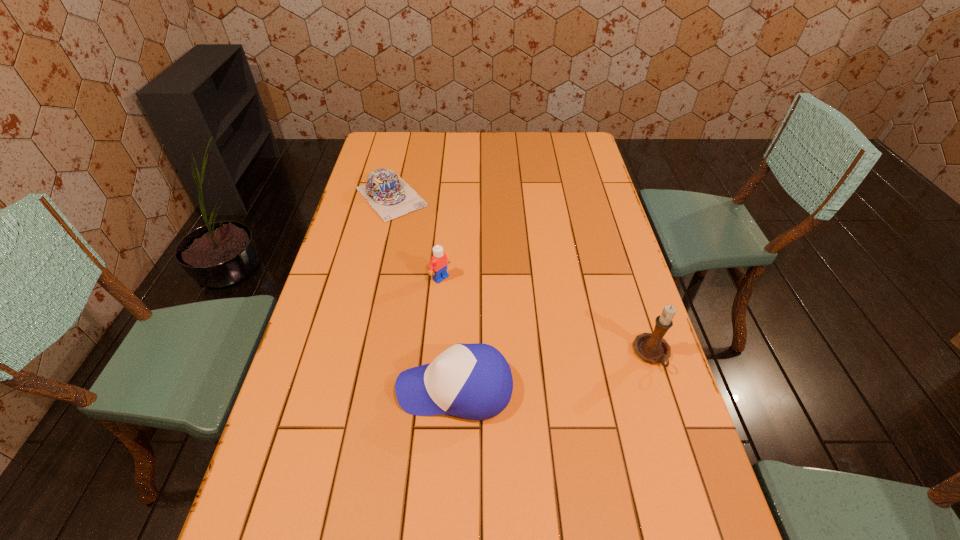
This screenshot has height=540, width=960. Find the location of `free point between the third nearest object and the farthest object`. free point between the third nearest object and the farthest object is located at coordinates (416, 237).

Image resolution: width=960 pixels, height=540 pixels. Identify the location of vacant space that is in between the cap and the baseball cap. (423, 293).

Where is `object that stands as the closest to the baseball cap`? This screenshot has width=960, height=540. object that stands as the closest to the baseball cap is located at coordinates (438, 265).

You are a GUI agent. You are given a task and a screenshot of the screen. Output one action in this format:
    pyautogui.click(x=<x>, y=<y>)
    Task: Click on the object that ranks as the closest to the second farthest object
    This screenshot has height=540, width=960.
    Given the screenshot: What is the action you would take?
    pyautogui.click(x=389, y=195)

The height and width of the screenshot is (540, 960). In order to click on free space that satisfies the following two spatial constraints: 1. on the front side of the baseball cap; 2. on the front-facing side of the farthest object in this screenshot , I will do `click(347, 388)`.